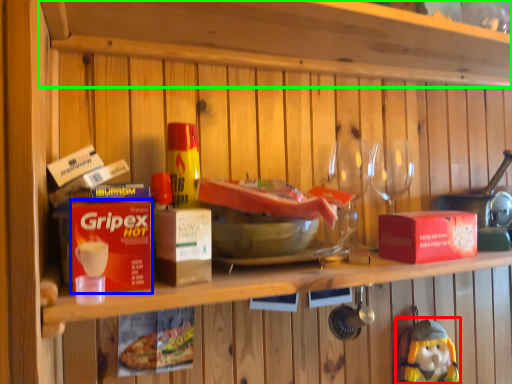
Question: Which object is the closest to the figurine (highlighted by a red box)? Choose among these: box (highlighted by a blue box) or shelf (highlighted by a green box).

Choices:
 (A) box
 (B) shelf

Answer: (B)